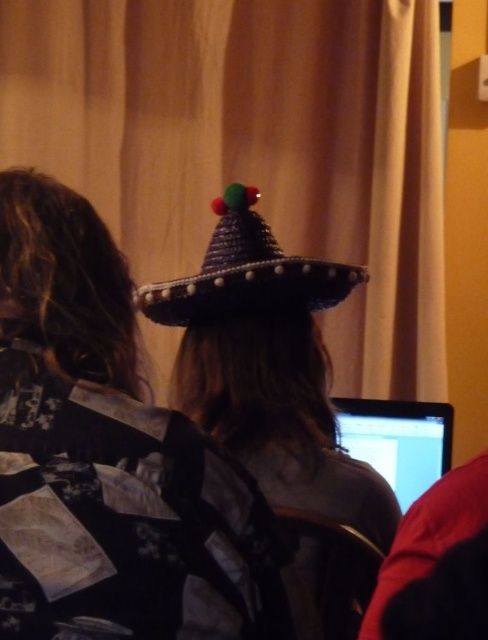
Does woven straw sombrero at upper center come in front of matte black laptop at lower right?

Yes, woven straw sombrero at upper center is closer to the viewer.

Describe the element at coordinates (246, 273) in the screenshot. I see `woven straw sombrero at upper center` at that location.

Is point (343, 269) positioned behind point (442, 410)?

No.

At what (x,y) coordinates should I click in order to perform the action: click on woven straw sombrero at upper center. Please return your answer as a coordinate pair (x, y). Looking at the image, I should click on pyautogui.click(x=246, y=273).

In the scene shown: Can you confirm if shiny metallic sombrero at center is positioned below woven straw sombrero at upper center?

Indeed, shiny metallic sombrero at center is positioned under woven straw sombrero at upper center.

Between shiny metallic sombrero at center and woven straw sombrero at upper center, which one has more height?

Standing taller between the two is shiny metallic sombrero at center.

Locate an element on the screen. The width and height of the screenshot is (488, 640). shiny metallic sombrero at center is located at coordinates (268, 369).

Is woven straw hat at center to the left of matte black laptop at lower right from the viewer's perspective?

Indeed, woven straw hat at center is positioned on the left side of matte black laptop at lower right.

Who is more distant from viewer, [135,522] or [362,420]?

Point [362,420]

This screenshot has height=640, width=488. In order to click on woven straw hat at center in this screenshot , I will do `click(108, 458)`.